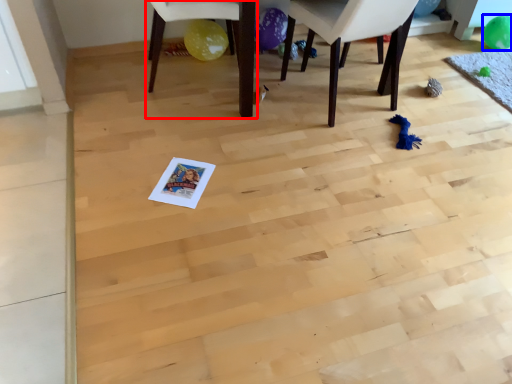
Question: Which of the following is the closest to the observer, chair (highlighted by a red box) or balloon (highlighted by a blue box)?

Choices:
 (A) chair
 (B) balloon

Answer: (A)